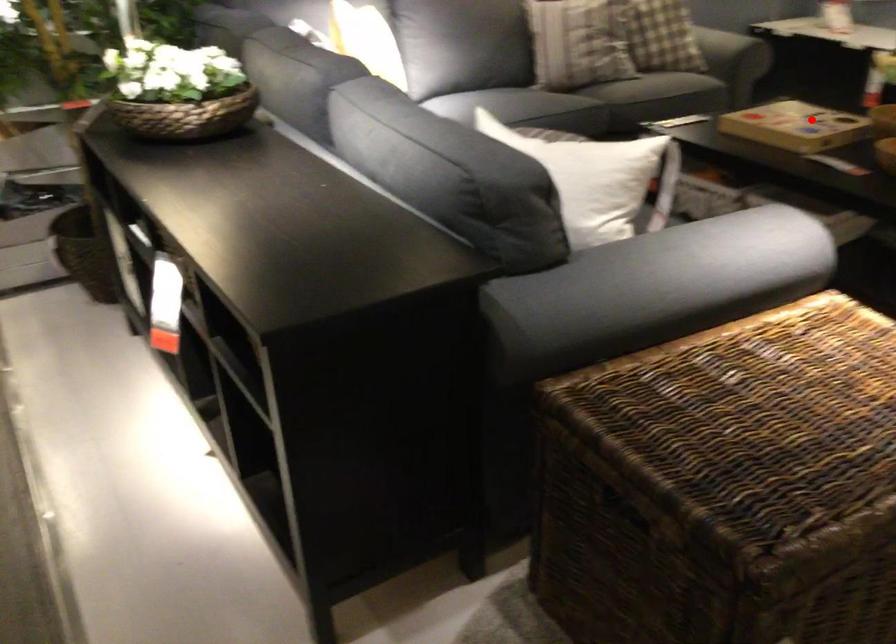
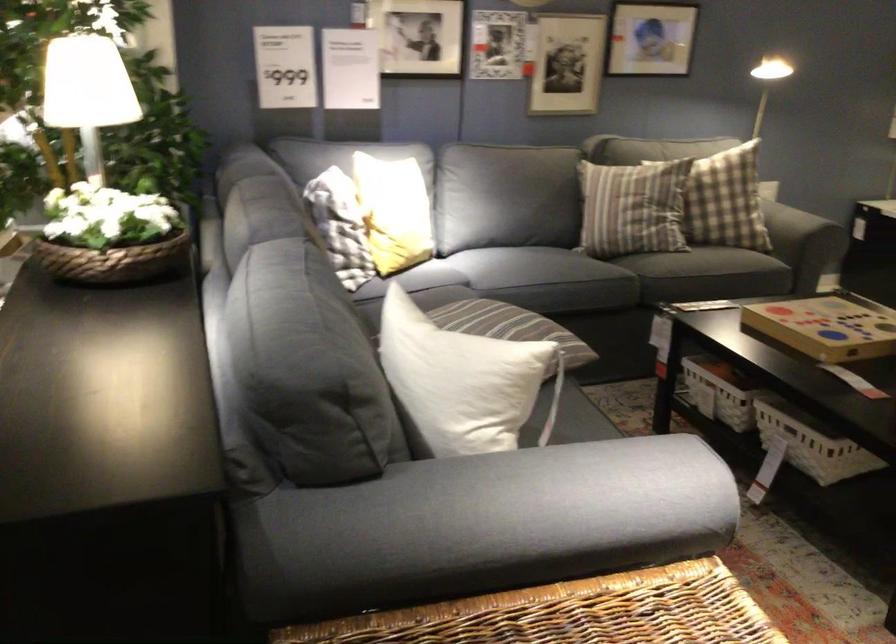
Question: I am providing you with two images of the same scene from different viewpoints. Image1 has a red point marked. In image2, the corresponding 3D location appears at what relative position? Reply with the corresponding letter.

Choices:
 (A) Closer
 (B) Farther

Answer: (A)